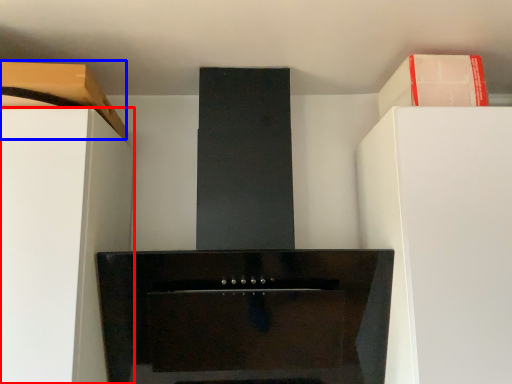
Question: Which of the following is the farthest to the observer, furniture (highlighted by a red box) or cabinetry (highlighted by a blue box)?

Choices:
 (A) furniture
 (B) cabinetry

Answer: (B)